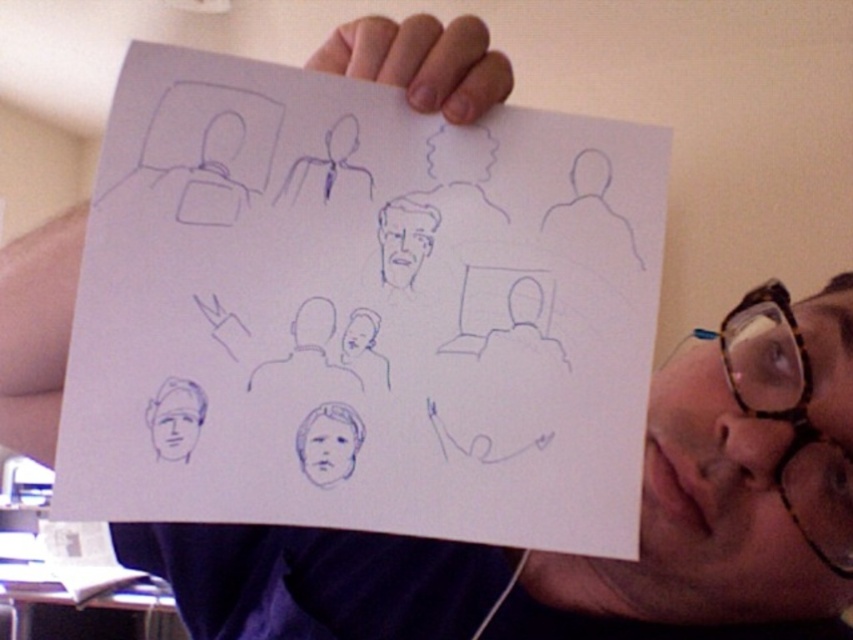
Who is more distant from viewer, (582, 355) or (334, 406)?

Positioned behind is point (582, 355).

Between blue pencil drawing at center and smooth blue face at center, which one appears on the left side from the viewer's perspective?

smooth blue face at center

At what (x,y) coordinates should I click in order to perform the action: click on blue pencil drawing at center. Please return your answer as a coordinate pair (x, y). The width and height of the screenshot is (853, 640). Looking at the image, I should click on (363, 308).

Is blue pencil drawing at center to the left of transparent tortoiseshell glasses at upper right from the viewer's perspective?

Yes, blue pencil drawing at center is to the left of transparent tortoiseshell glasses at upper right.

You are a GUI agent. You are given a task and a screenshot of the screen. Output one action in this format:
    pyautogui.click(x=<x>, y=<y>)
    Task: Click on the blue pencil drawing at center
    Image resolution: width=853 pixels, height=640 pixels.
    Given the screenshot: What is the action you would take?
    pyautogui.click(x=363, y=308)

The image size is (853, 640). Find the location of `blue pencil drawing at center`. blue pencil drawing at center is located at coordinates pyautogui.click(x=363, y=308).

Who is positioned more to the left, blue pencil drawing at center or blue sketchy head at lower left?

blue sketchy head at lower left

Can you confirm if blue pencil drawing at center is taller than blue sketchy head at lower left?

Yes, blue pencil drawing at center is taller than blue sketchy head at lower left.

Does point (569, 340) lie behind point (165, 396)?

That is True.

Identify the location of blue pencil drawing at center. This screenshot has width=853, height=640. (363, 308).